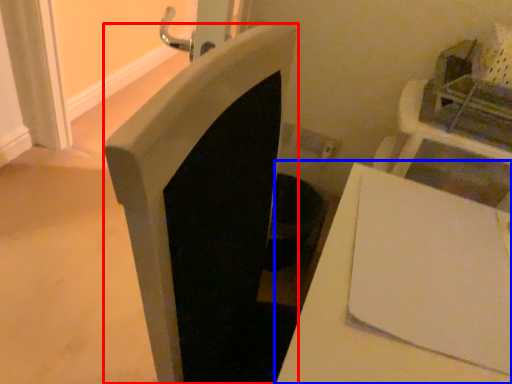
Question: Which object appears closest to the camera in this image, fireplace (highlighted by a red box) or table (highlighted by a blue box)?

Choices:
 (A) fireplace
 (B) table

Answer: (B)